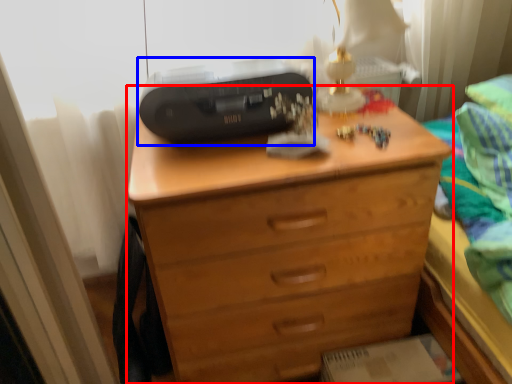
Question: Which object is closer to the camera taking this photo, chest of drawers (highlighted by a red box) or printer (highlighted by a blue box)?

Choices:
 (A) chest of drawers
 (B) printer

Answer: (A)